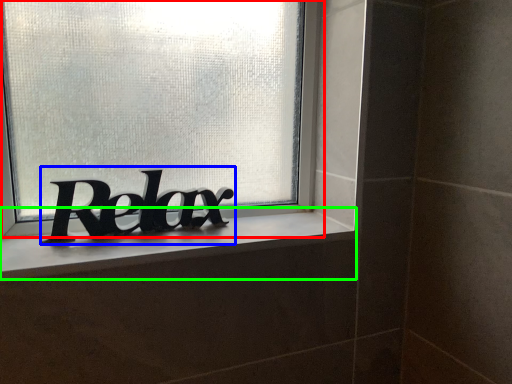
Question: Which is nearer to the window (highlighted by a red box)? lettering (highlighted by a blue box) or window sill (highlighted by a green box).

Choices:
 (A) lettering
 (B) window sill

Answer: (A)